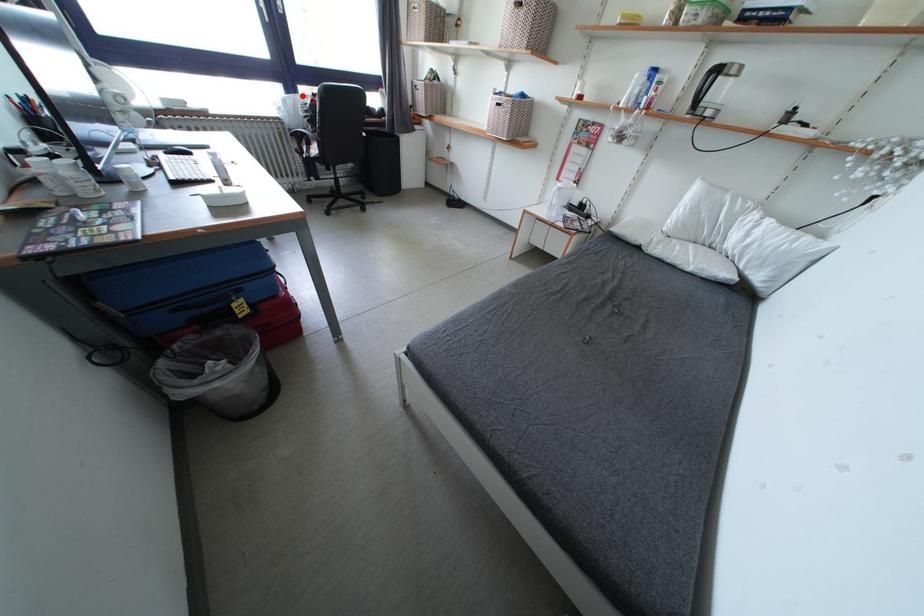
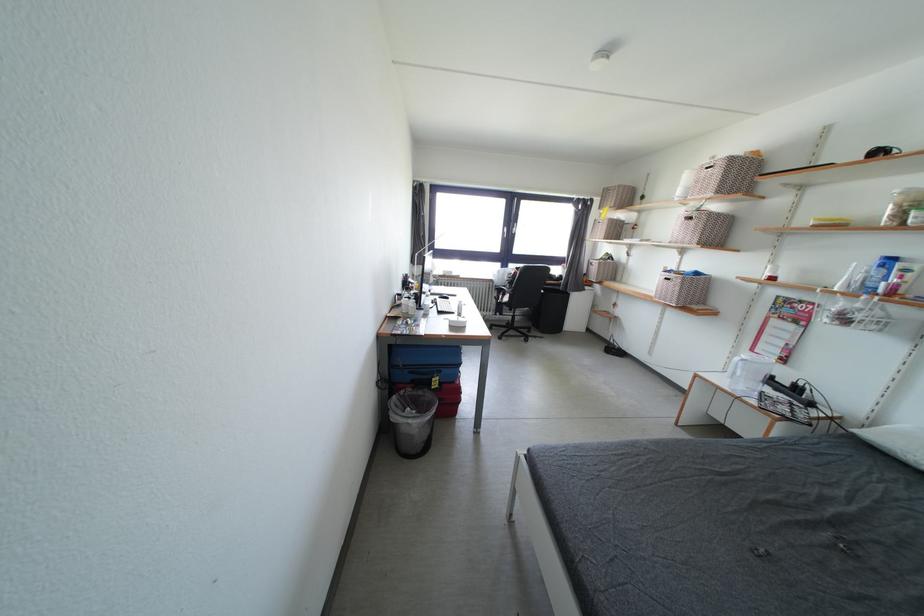
Where in the second image is the point corresponding to the highlighted location from the first image?

(514, 270)